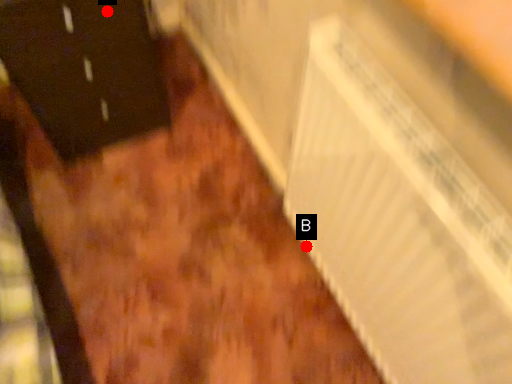
Question: Two points are circled on the image, labeled by A and B beside each circle. Which point is closer to the camera?

Choices:
 (A) A is closer
 (B) B is closer

Answer: (A)